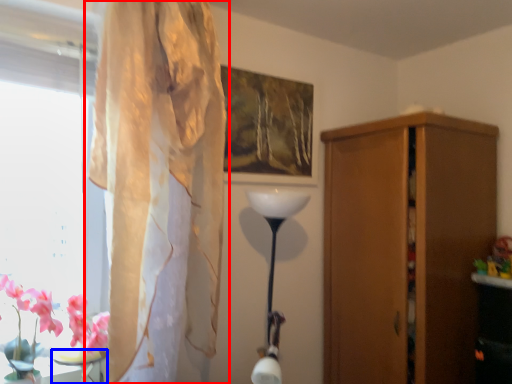
Question: Among these objects, which one is nearest to the camera, curtain (highlighted by a red box) or table (highlighted by a blue box)?

Choices:
 (A) curtain
 (B) table

Answer: (A)